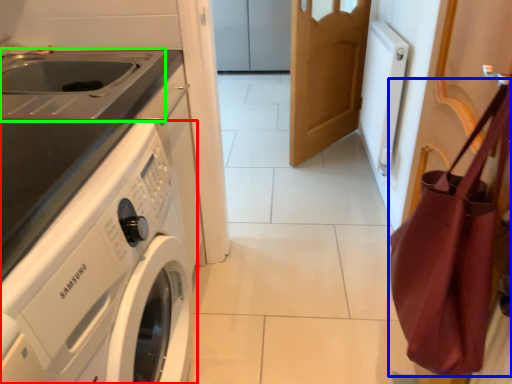
Question: Which is nearer to the washing machine (highlighted by a red box)? shoulder bag (highlighted by a blue box) or sink (highlighted by a green box).

Choices:
 (A) shoulder bag
 (B) sink

Answer: (B)